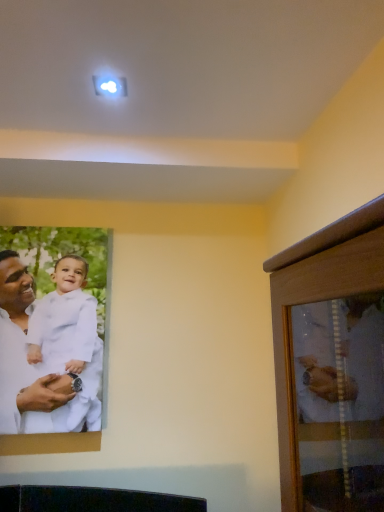
You are a GUI agent. You are given a task and a screenshot of the screen. Output one action in this format:
    pyautogui.click(x=<x>, y=<y>)
    Task: Click on the white cotton shirt at left
    The image size is (384, 512).
    Given the screenshot: What is the action you would take?
    pyautogui.click(x=23, y=359)

In order to face white cotton shirt at left, should I rotate leftwards or rightwards?

Turn left by 18.725 degrees to look at white cotton shirt at left.

What do you see at coordinates (23, 359) in the screenshot? I see `white cotton shirt at left` at bounding box center [23, 359].

What is the approximate height of white cotton shirt at left?

white cotton shirt at left is 29.63 inches in height.

At what (x,y) coordinates should I click in order to perform the action: click on white cotton shirt at left. Please return your answer as a coordinate pair (x, y). The width and height of the screenshot is (384, 512). Looking at the image, I should click on (23, 359).